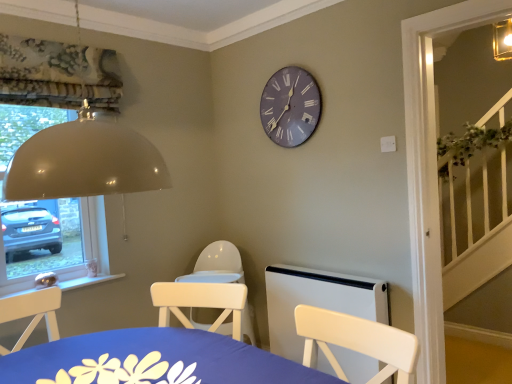
Image resolution: width=512 pixels, height=384 pixels. What do you see at coordinates (290, 106) in the screenshot?
I see `matte gray clock at upper center` at bounding box center [290, 106].

What do you see at coordinates (153, 360) in the screenshot? I see `blue fabric table at lower center` at bounding box center [153, 360].

Locate an element on the screen. The image size is (512, 384). blue fabric table at lower center is located at coordinates (153, 360).

You are a GUI agent. You are given a task and a screenshot of the screen. Output one action in this format:
    pyautogui.click(x=<x>, y=<y>)
    Task: Click on the matte gray clock at upper center
    
    Given the screenshot: What is the action you would take?
    pyautogui.click(x=290, y=106)

Is matte gray clock at upper center oriented away from blue fabric table at lower center?

matte gray clock at upper center is not turned away from blue fabric table at lower center.

From a real-world perspective, is matte gray clock at upper center on blue fabric table at lower center?

Correct, in the physical world, matte gray clock at upper center is higher than blue fabric table at lower center.

Is matte gray clock at upper center to the right of blue fabric table at lower center from the viewer's perspective?

Indeed, matte gray clock at upper center is positioned on the right side of blue fabric table at lower center.

Is there a large distance between matte gray clock at upper center and blue fabric table at lower center?

Yes, matte gray clock at upper center and blue fabric table at lower center are located far from each other.

Considering the positions of objects white plastic radiator at lower center and blue fabric table at lower center in the image provided, who is more to the right, white plastic radiator at lower center or blue fabric table at lower center?

white plastic radiator at lower center.

Considering the sizes of white plastic radiator at lower center and blue fabric table at lower center in the image, is white plastic radiator at lower center wider or thinner than blue fabric table at lower center?

Clearly, white plastic radiator at lower center has less width compared to blue fabric table at lower center.

Considering the relative positions of white plastic radiator at lower center and blue fabric table at lower center in the image provided, is white plastic radiator at lower center behind blue fabric table at lower center?

Yes, it is.

Considering the sizes of white plastic radiator at lower center and blue fabric table at lower center in the image, is white plastic radiator at lower center taller or shorter than blue fabric table at lower center?

In the image, white plastic radiator at lower center appears to be taller than blue fabric table at lower center.

Does matte gray clock at upper center have a smaller size compared to white plastic radiator at lower center?

Yes.

Is point (279, 105) farther from camera compared to point (387, 313)?

Yes, it is.

Is matte gray clock at upper center wider or thinner than white plastic radiator at lower center?

matte gray clock at upper center is thinner than white plastic radiator at lower center.

Which object is further away from the camera, matte gray clock at upper center or white plastic radiator at lower center?

matte gray clock at upper center is further away from the camera.

From the image's perspective, which is below, white plastic radiator at lower center or matte gray clock at upper center?

white plastic radiator at lower center appears lower in the image.

Is white plastic radiator at lower center shorter than matte gray clock at upper center?

Yes, white plastic radiator at lower center is shorter than matte gray clock at upper center.

Can you tell me how much white plastic radiator at lower center and matte gray clock at upper center differ in facing direction?

The angle between the facing direction of white plastic radiator at lower center and the facing direction of matte gray clock at upper center is 0.0228 degrees.

Does white plastic radiator at lower center have a lesser width compared to matte gray clock at upper center?

No.

Where is `table in front of the white plastic radiator at lower center`? The height and width of the screenshot is (384, 512). table in front of the white plastic radiator at lower center is located at coordinates tap(153, 360).

Is blue fabric table at lower center aimed at white plastic radiator at lower center?

No.

From the image's perspective, relative to white plastic radiator at lower center, is blue fabric table at lower center above or below?

blue fabric table at lower center is above white plastic radiator at lower center.

Which is nearer, (x=18, y=354) or (x=350, y=284)?

Point (x=18, y=354) appears to be closer to the viewer than point (x=350, y=284).

Between blue fabric table at lower center and matte gray clock at upper center, which one appears on the right side from the viewer's perspective?

matte gray clock at upper center.

Which object is more forward, blue fabric table at lower center or matte gray clock at upper center?

blue fabric table at lower center is in front.

Is blue fabric table at lower center taller than matte gray clock at upper center?

In fact, blue fabric table at lower center may be shorter than matte gray clock at upper center.

Identify the location of table below the matte gray clock at upper center (from the image's perspective). This screenshot has width=512, height=384. (153, 360).

Find the location of a particular element. table above the white plastic radiator at lower center (from a real-world perspective) is located at coordinates (153, 360).

Considering their positions, is white plastic radiator at lower center positioned closer to blue fabric table at lower center than matte gray clock at upper center?

Among the two, white plastic radiator at lower center is located nearer to blue fabric table at lower center.

Considering their positions, is matte gray clock at upper center positioned further to white plastic radiator at lower center than blue fabric table at lower center?

Based on the image, blue fabric table at lower center appears to be further to white plastic radiator at lower center.

In the scene shown: Considering their positions, is white plastic radiator at lower center positioned closer to matte gray clock at upper center than blue fabric table at lower center?

white plastic radiator at lower center lies closer to matte gray clock at upper center than the other object.

When comparing their distances from blue fabric table at lower center, does matte gray clock at upper center or white plastic radiator at lower center seem further?

matte gray clock at upper center.

Looking at this image, when comparing their distances from matte gray clock at upper center, does blue fabric table at lower center or white plastic radiator at lower center seem closer?

white plastic radiator at lower center is closer to matte gray clock at upper center.

Considering their positions, is blue fabric table at lower center positioned further to white plastic radiator at lower center than matte gray clock at upper center?

blue fabric table at lower center is further to white plastic radiator at lower center.

In order to click on bed frame located between blue fabric table at lower center and matte gray clock at upper center in the depth direction in this screenshot , I will do `click(317, 301)`.